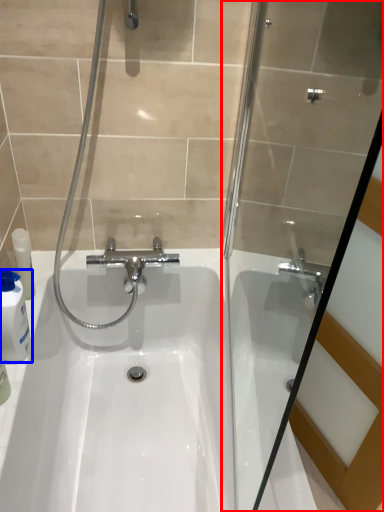
Question: Among these objects, which one is nearest to the camera, shower door (highlighted by a red box) or cleaning product (highlighted by a blue box)?

Choices:
 (A) shower door
 (B) cleaning product

Answer: (A)